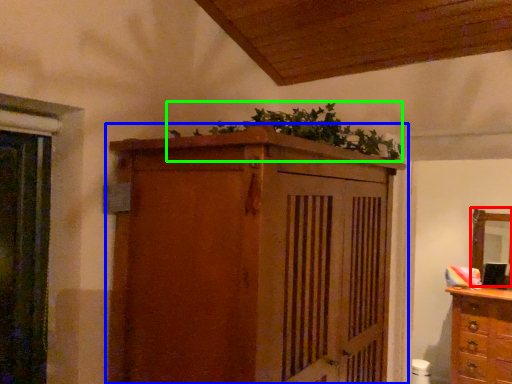
Question: Based on their relative distances, which object is nearer to mirror (highlighted by a red box)? Choose from cupboard (highlighted by a blue box) and plant (highlighted by a green box).

Choices:
 (A) cupboard
 (B) plant

Answer: (B)